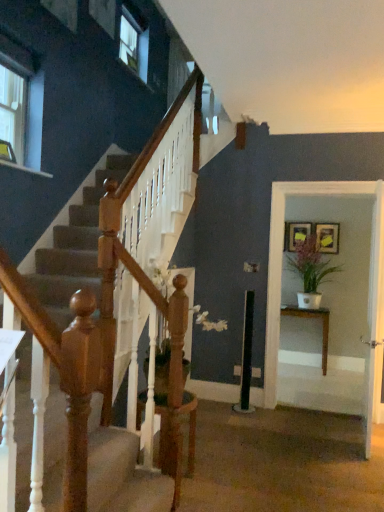
Question: From the image's perspective, is white glossy door at center located above or below white glossy table at right?

Choices:
 (A) above
 (B) below

Answer: (B)

Question: Does point (379, 344) appear closer or farther from the camera than point (375, 273)?

Choices:
 (A) farther
 (B) closer

Answer: (B)

Question: Estimate the real-world distances between objects in this image. Which object is farther from the wooden picture frame at upper right, which is the second picture frame from left to right?

Choices:
 (A) green matte plant at right
 (B) white glossy door at center
 (C) white glossy table at right
 (D) clear glass window at upper left
 (E) wooden table at right

Answer: (D)

Question: Estimate the real-world distances between objects in this image. Which object is farther from the matte gold picture frame at upper right, which is the first picture frame in left-to-right order?

Choices:
 (A) wooden table at right
 (B) clear glass window at upper left
 (C) white glossy table at right
 (D) white glossy door at center
 (E) green matte plant at right

Answer: (B)